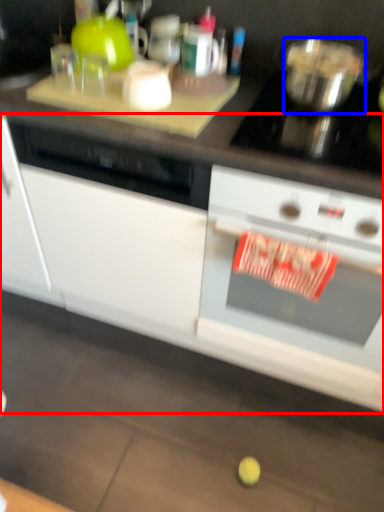
Question: Which object is further to the camera taking this photo, cabinetry (highlighted by a red box) or bowl (highlighted by a blue box)?

Choices:
 (A) cabinetry
 (B) bowl

Answer: (B)